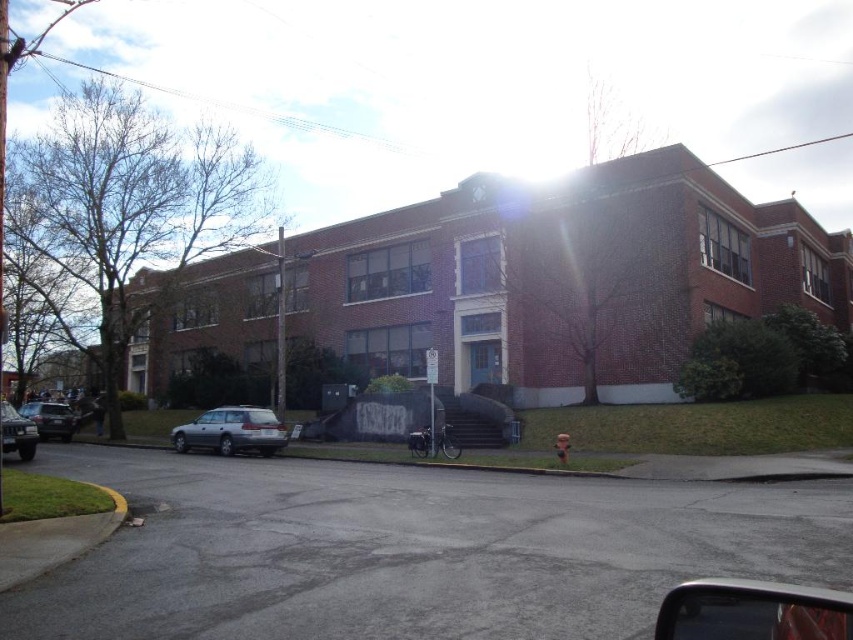
Question: Among these points, which one is farthest from the camera?

Choices:
 (A) (16, 428)
 (B) (47, 428)
 (C) (215, 420)

Answer: (B)

Question: Can you confirm if shiny silver sedan at left is positioned above metallic silver sedan at lower left?

Choices:
 (A) no
 (B) yes

Answer: (A)

Question: Which of these objects is positioned closest to the satin silver station wagon at lower left?

Choices:
 (A) shiny silver sedan at left
 (B) metallic silver sedan at lower left

Answer: (B)

Question: Can you confirm if satin silver station wagon at lower left is thinner than shiny silver sedan at left?

Choices:
 (A) yes
 (B) no

Answer: (A)

Question: Does satin silver station wagon at lower left have a smaller size compared to shiny silver sedan at left?

Choices:
 (A) no
 (B) yes

Answer: (B)

Question: Which of the following is the closest to the observer?

Choices:
 (A) metallic silver sedan at lower left
 (B) shiny silver sedan at left

Answer: (A)